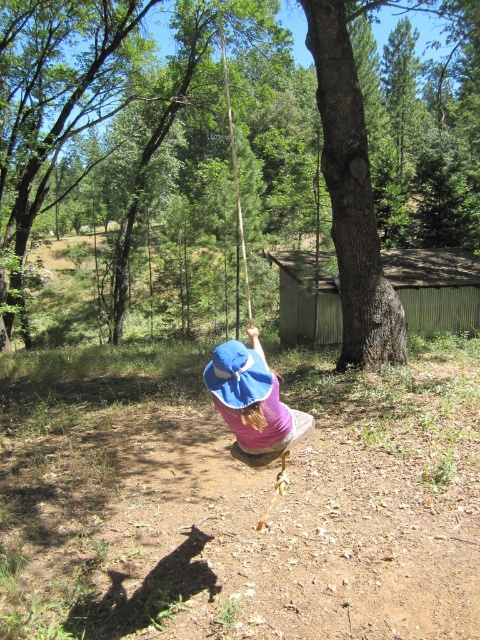
Question: Is brown rough tree at center below smooth bark tree at center?

Choices:
 (A) yes
 (B) no

Answer: (B)

Question: Is brown rough tree at center thinner than pink fabric sunhat at center?

Choices:
 (A) yes
 (B) no

Answer: (B)

Question: Does smooth bark tree at center have a greater width compared to wooden swing at center?

Choices:
 (A) no
 (B) yes

Answer: (A)

Question: Which of the following is the closest to the observer?

Choices:
 (A) pink fabric sunhat at center
 (B) brown rough tree at center
 (C) smooth bark tree at center

Answer: (A)

Question: Which point is farther to the camera?

Choices:
 (A) (268, 454)
 (B) (241, 248)
 (C) (337, 243)

Answer: (B)

Question: Which of these objects is positioned closest to the pink fabric sunhat at center?

Choices:
 (A) wooden swing at center
 (B) brown rough tree at center
 (C) smooth bark tree at center

Answer: (C)